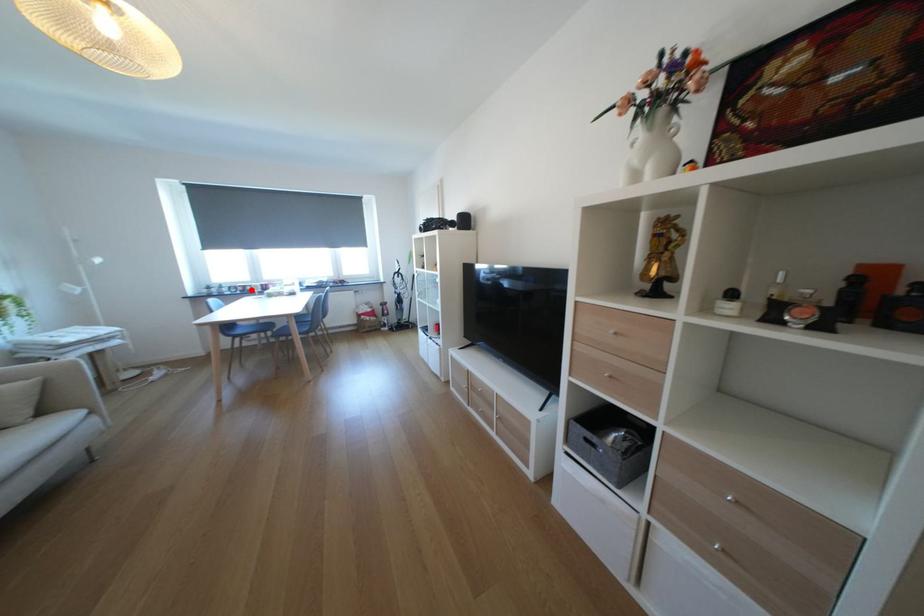
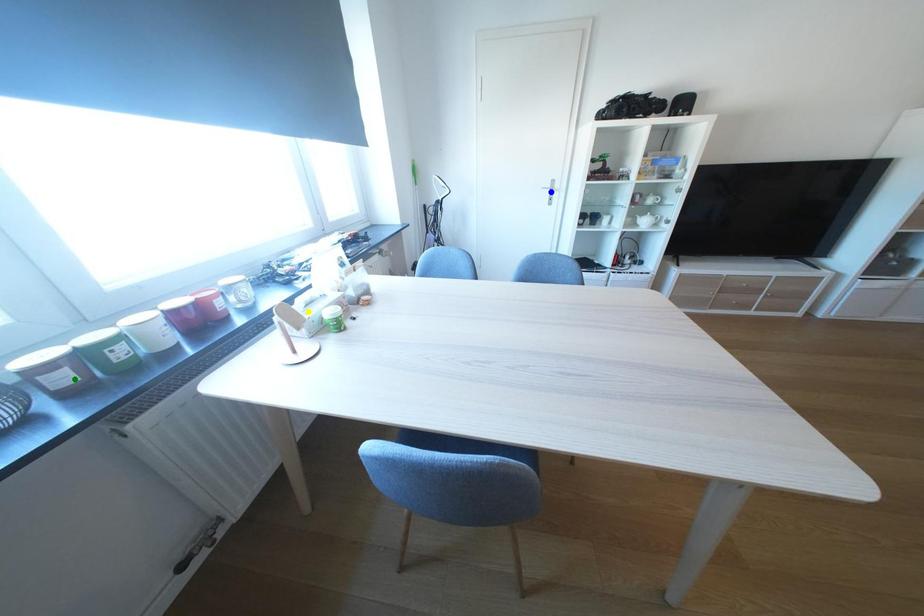
Question: I am providing you with two images of the same scene from different viewpoints. A red point is marked on the first image. You are given multiple points on the second image. Can you choose the point in image 2 that corresponds to the point in image 1?

Choices:
 (A) green point
 (B) blue point
 (C) yellow point

Answer: (A)